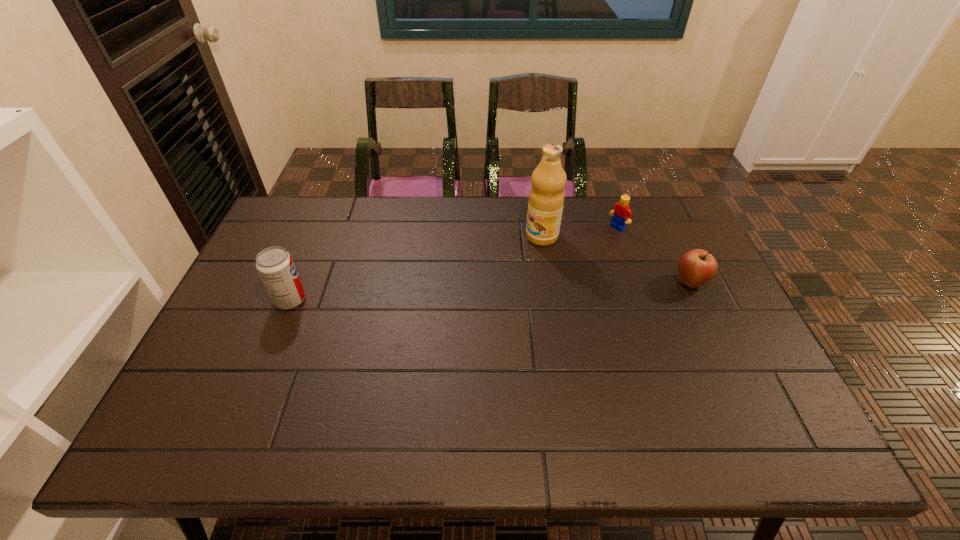
At what (x,y) coordinates should I click in order to perform the action: click on free spot on the desktop that is between the leftmost object and the rightmost object and is positioned on the front-facing side of the third object from left to right. Please return your answer as a coordinate pair (x, y). Looking at the image, I should click on (521, 290).

Where is `vacant space on the desktop that is between the soda and the rightmost object and is positioned on the label of the third object from right to left`? vacant space on the desktop that is between the soda and the rightmost object and is positioned on the label of the third object from right to left is located at coordinates (448, 293).